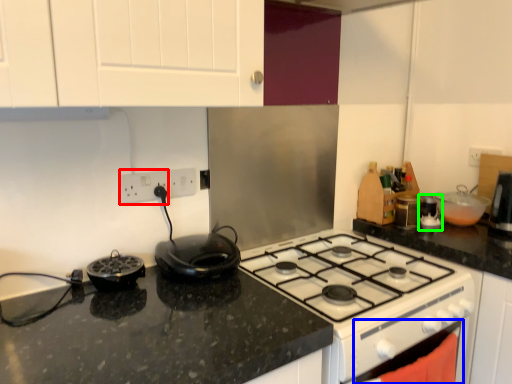
Question: Which object is the farthest from electric outlet (highlighted by a red box)? Choose among these: oven (highlighted by a blue box) or appliance (highlighted by a green box).

Choices:
 (A) oven
 (B) appliance

Answer: (B)